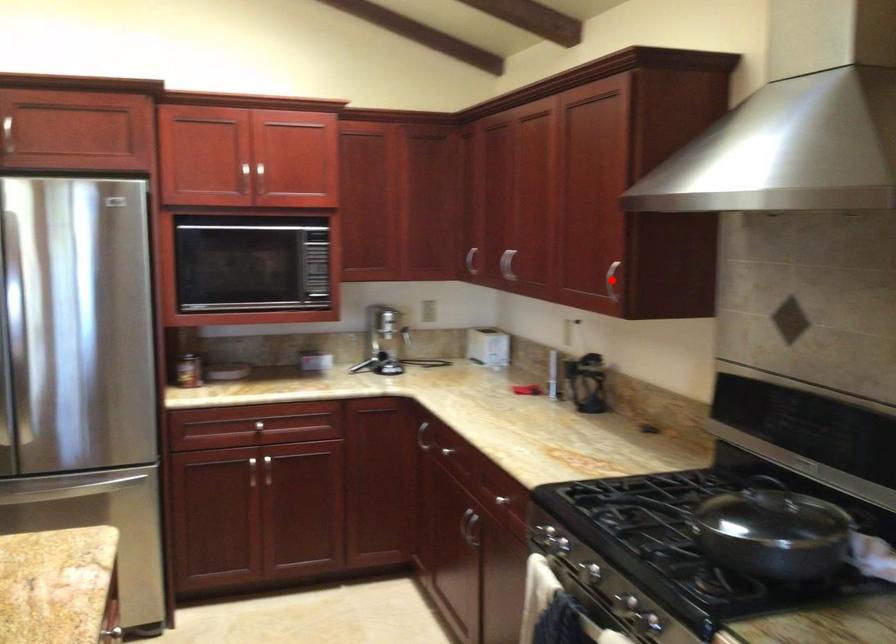
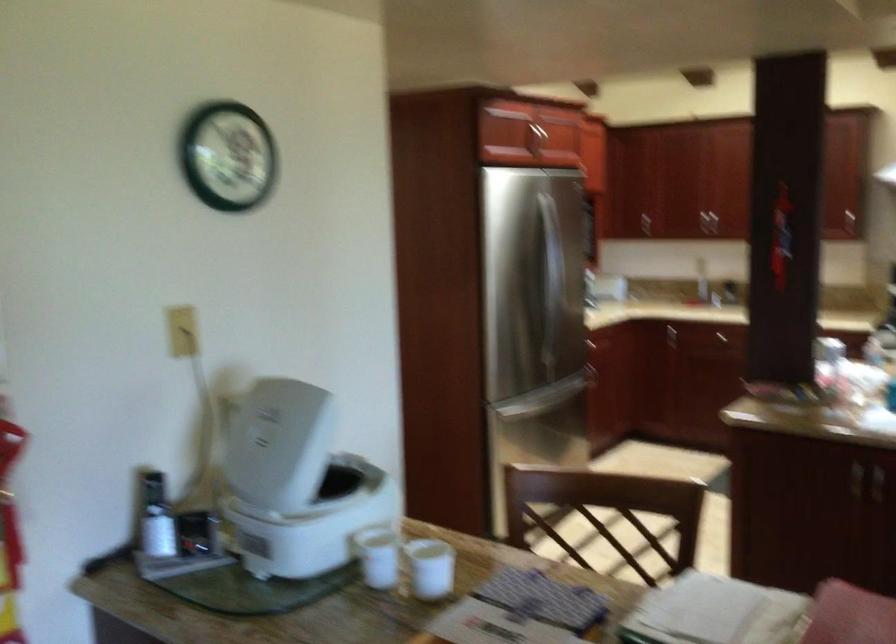
Question: I am providing you with two images of the same scene from different viewpoints. A red point is marked on the first image. Is the red point's position out of view in image 2?

Choices:
 (A) Yes
 (B) No

Answer: (A)